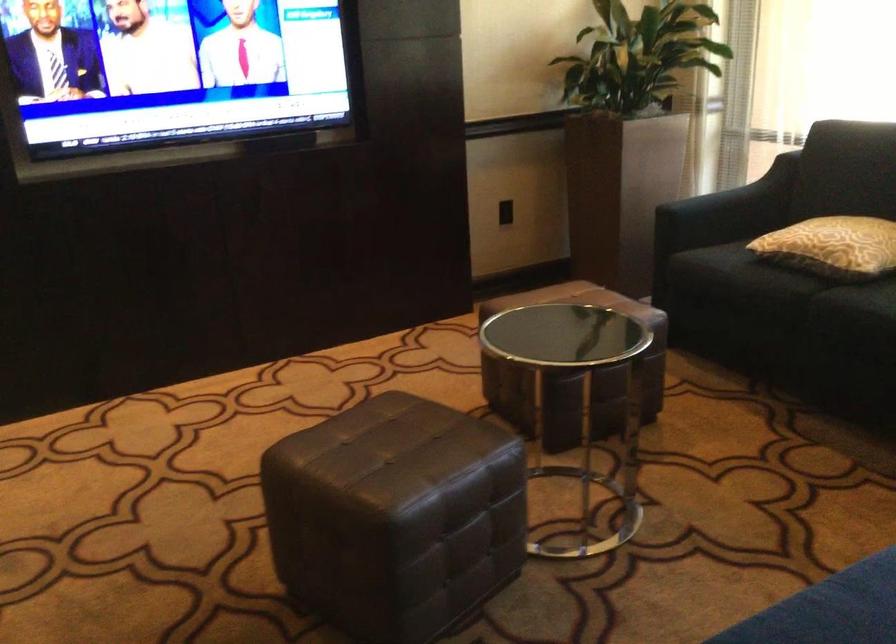
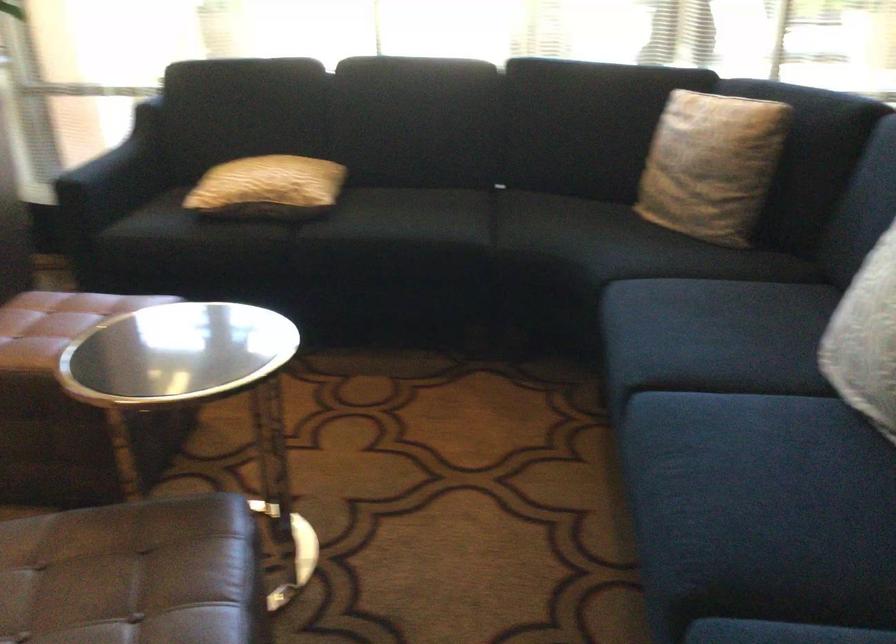
Locate, in the second image, the point that corresponds to [407,451] in the first image.

(134, 574)